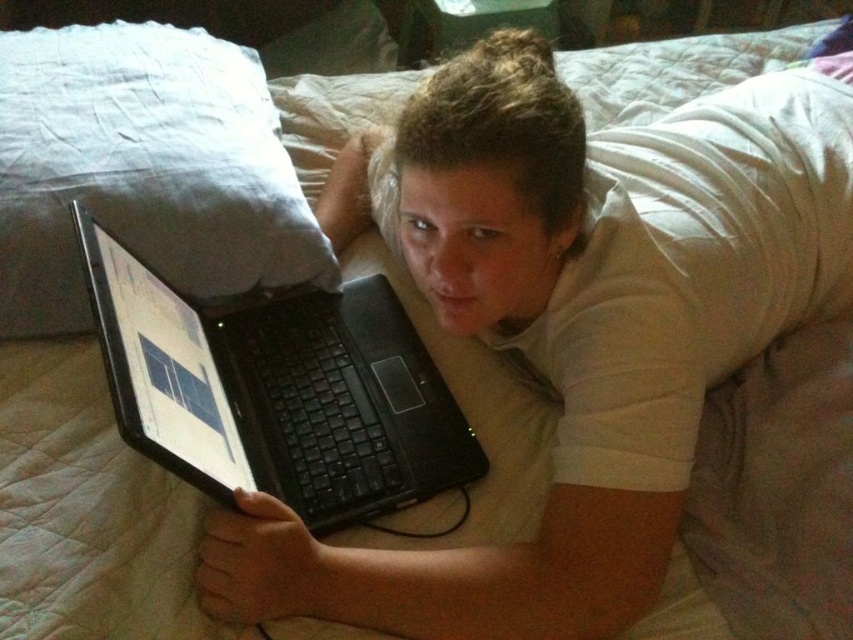
In the scene shown: Who is shorter, white soft pillow at upper left or black matte laptop at center?

With less height is black matte laptop at center.

Locate an element on the screen. The image size is (853, 640). white soft pillow at upper left is located at coordinates (143, 170).